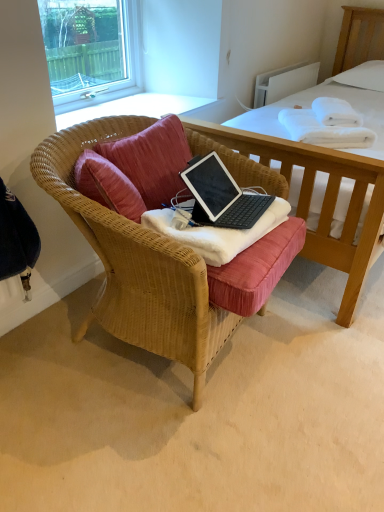
Question: From the image's perspective, relative to pink fabric pillow at center, is clear glass window at upper left above or below?

Choices:
 (A) above
 (B) below

Answer: (A)

Question: Is clear glass window at upper left inside or outside of pink fabric pillow at center?

Choices:
 (A) outside
 (B) inside

Answer: (A)

Question: Which object is the farthest from the white cotton bed at center?

Choices:
 (A) black matte laptop at center
 (B) clear glass window at upper left
 (C) white soft towels at upper right
 (D) white soft towel at upper right, the 1th blanket when ordered from right to left
 (E) woven wood chair at center

Answer: (E)

Question: Considering the real-world distances, which object is farthest from the clear glass window at upper left?

Choices:
 (A) white soft towels at upper right
 (B) black matte laptop at center
 (C) pink fabric pillow at center
 (D) white cotton bed at center
 (E) white soft blanket at center, which is counted as the second blanket, starting from the back

Answer: (E)